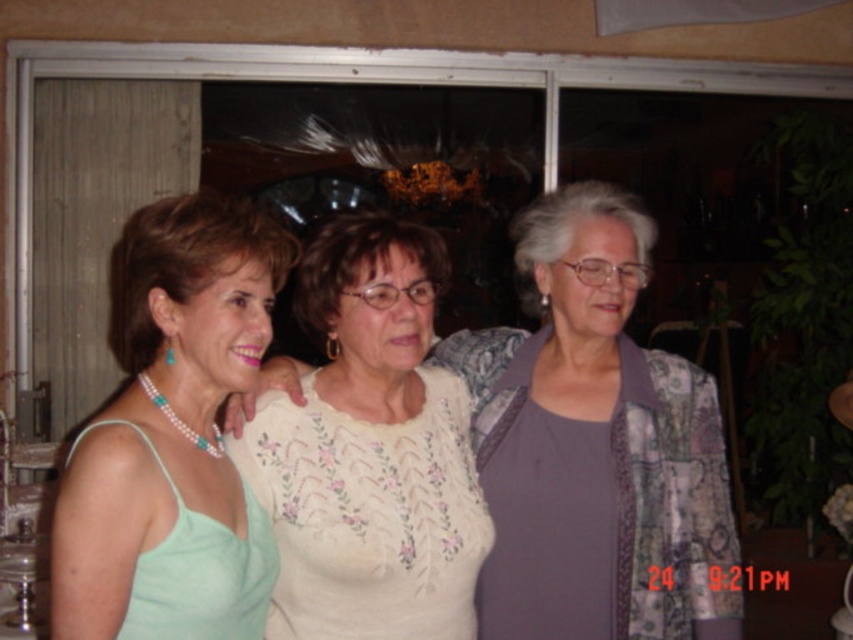
Does pearl necklace at left have a greater width compared to white embroidered blouse at center?

No, pearl necklace at left is not wider than white embroidered blouse at center.

Is pearl necklace at left shorter than white embroidered blouse at center?

Yes, pearl necklace at left is shorter than white embroidered blouse at center.

Who is more forward, (106, 627) or (271, 452)?

Point (106, 627) is in front.

You are a GUI agent. You are given a task and a screenshot of the screen. Output one action in this format:
    pyautogui.click(x=<x>, y=<y>)
    Task: Click on the pearl necklace at left
    This screenshot has width=853, height=640.
    Given the screenshot: What is the action you would take?
    pyautogui.click(x=172, y=435)

Is purple fabric at center taller than pearl necklace at left?

Yes, purple fabric at center is taller than pearl necklace at left.

Based on the photo, can you confirm if purple fabric at center is smaller than pearl necklace at left?

No, purple fabric at center is not smaller than pearl necklace at left.

The height and width of the screenshot is (640, 853). In order to click on purple fabric at center in this screenshot , I will do `click(601, 449)`.

The image size is (853, 640). I want to click on purple fabric at center, so click(x=601, y=449).

Between purple fabric at center and white embroidered blouse at center, which one is positioned higher?

purple fabric at center is above.

Between point (538, 419) and point (337, 291), which one is positioned in front?

Point (337, 291) is in front.

Is point (722, 621) farther from viewer compared to point (257, 424)?

Yes, it is.

Find the location of a particular element. purple fabric at center is located at coordinates (601, 449).